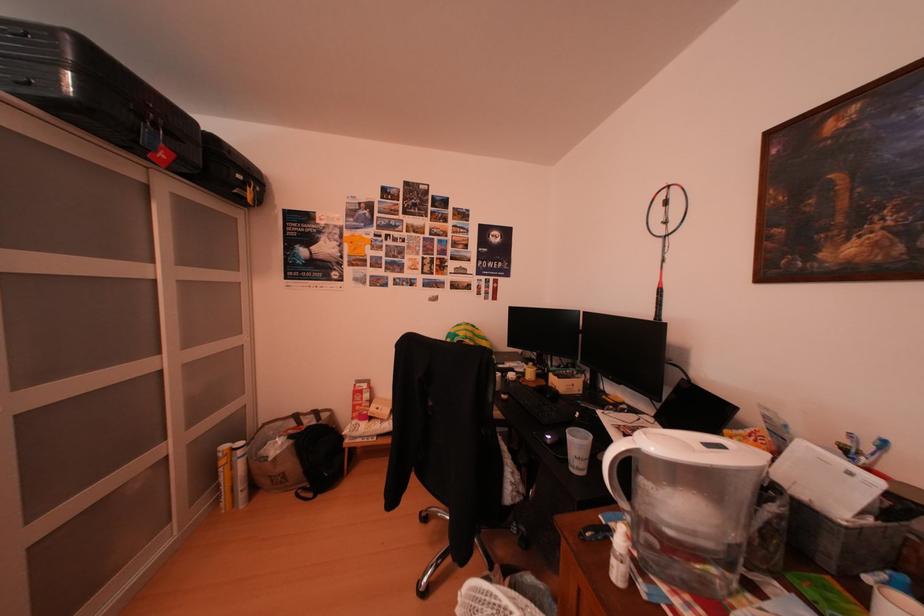
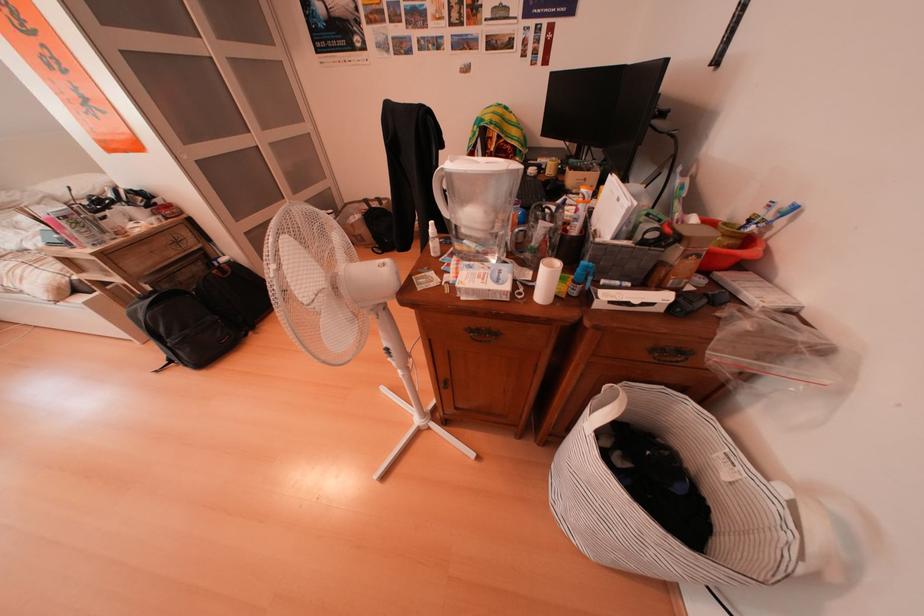
Where in the second image is the point corresponding to [864,440] from the first image?

(784, 209)